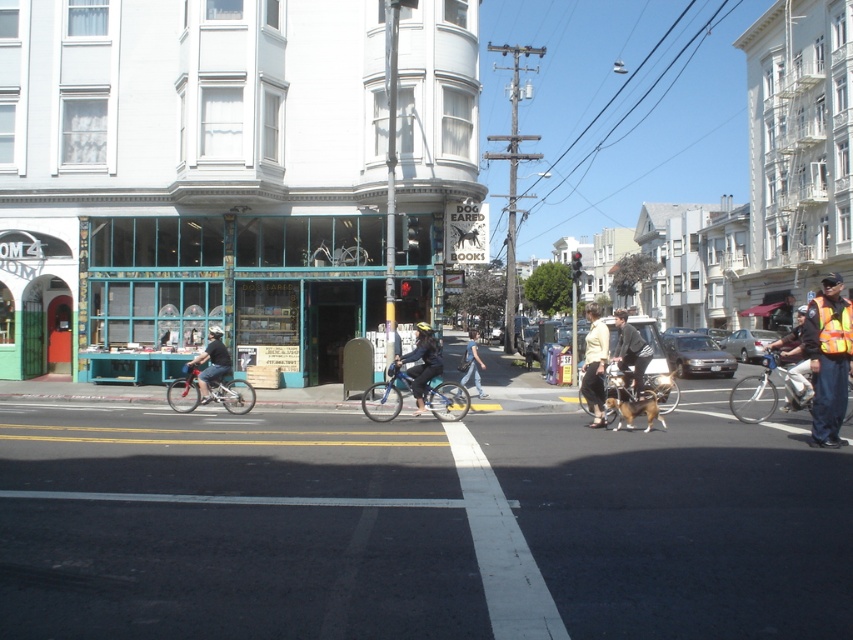
Between point (567, 557) and point (614, 352), which one is positioned in front?

Point (567, 557)

Can you confirm if metallic bicycle at center is positioned above black leather jacket at center?

No, metallic bicycle at center is not above black leather jacket at center.

The image size is (853, 640). In order to click on metallic bicycle at center in this screenshot , I will do `click(234, 528)`.

Where is `metallic bicycle at center`? The width and height of the screenshot is (853, 640). metallic bicycle at center is located at coordinates (234, 528).

Who is higher up, light yellow shirt at center or reflective silver helmet at center?

Positioned higher is reflective silver helmet at center.

Locate an element on the screen. Image resolution: width=853 pixels, height=640 pixels. light yellow shirt at center is located at coordinates (595, 364).

Between point (590, 401) and point (790, 403), which one is positioned in front?

Point (790, 403) is more forward.

Where is `light yellow shirt at center`? The width and height of the screenshot is (853, 640). light yellow shirt at center is located at coordinates (595, 364).

Between point (544, 449) and point (415, 346), which one is positioned behind?

The point (415, 346) is behind.

Measure the distance between metallic bicycle at center and dark blue fabric jacket at center.

metallic bicycle at center is 19.57 feet from dark blue fabric jacket at center.

The image size is (853, 640). Find the location of `metallic bicycle at center`. metallic bicycle at center is located at coordinates (234, 528).

Locate an element on the screen. This screenshot has height=640, width=853. metallic bicycle at center is located at coordinates (234, 528).